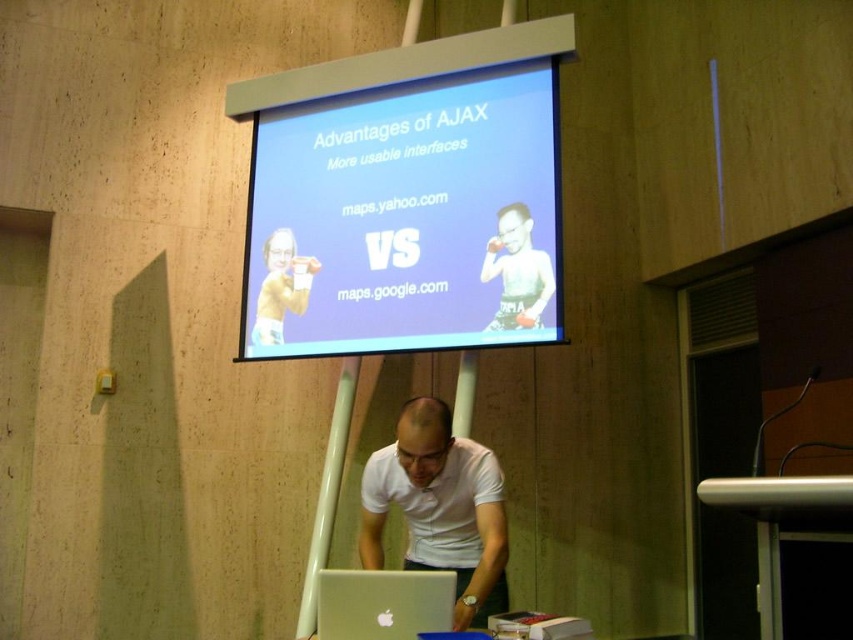
Which is in front, point (364, 525) or point (347, 602)?

Point (347, 602)

Is point (440, 419) farther from viewer compared to point (347, 627)?

Yes.

Identify the location of white matte shirt at center. (440, 508).

Looking at this image, is metallic silver table at lower right smaller than matte white boxer at center?

No.

Can you confirm if metallic silver table at lower right is shorter than matte white boxer at center?

Correct, metallic silver table at lower right is not as tall as matte white boxer at center.

I want to click on metallic silver table at lower right, so click(x=776, y=524).

Identify the location of metallic silver table at lower right. (776, 524).

Is blue glossy projector screen at center behind silver metallic laptop at lower center?

That is True.

How distant is blue glossy projector screen at center from silver metallic laptop at lower center?

blue glossy projector screen at center is 1.86 meters away from silver metallic laptop at lower center.

Between point (523, 76) and point (364, 570), which one is positioned behind?

Point (523, 76)

Identify the location of blue glossy projector screen at center. (405, 218).